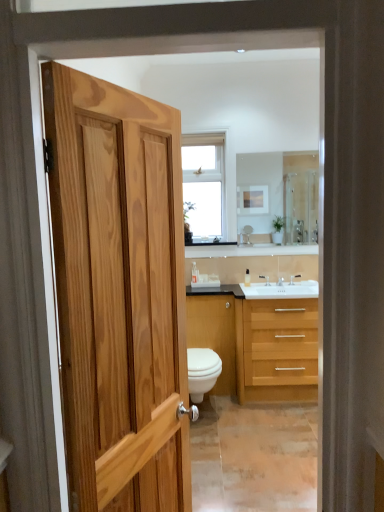
Question: Does satin nickel faucet at center, which appears as the 2th faucet when viewed from the left, have a greater height compared to white glossy toilet at center?

Choices:
 (A) no
 (B) yes

Answer: (A)

Question: From a real-world perspective, is satin nickel faucet at center, which appears as the 2th faucet when viewed from the left, on top of white glossy toilet at center?

Choices:
 (A) yes
 (B) no

Answer: (A)

Question: From the image's perspective, is satin nickel faucet at center, which is counted as the second faucet, starting from the right, beneath white glossy toilet at center?

Choices:
 (A) yes
 (B) no

Answer: (B)

Question: Considering the relative sizes of satin nickel faucet at center, which is counted as the second faucet, starting from the right, and white glossy toilet at center in the image provided, is satin nickel faucet at center, which is counted as the second faucet, starting from the right, wider than white glossy toilet at center?

Choices:
 (A) no
 (B) yes

Answer: (A)

Question: Is satin nickel faucet at center, which is counted as the second faucet, starting from the right, oriented away from white glossy toilet at center?

Choices:
 (A) yes
 (B) no

Answer: (B)

Question: Does satin nickel faucet at center, which is counted as the second faucet, starting from the right, have a larger size compared to white glossy toilet at center?

Choices:
 (A) no
 (B) yes

Answer: (A)

Question: Is translucent plastic bottle at center taller than white glossy cabinet at center?

Choices:
 (A) yes
 (B) no

Answer: (B)

Question: Is translucent plastic bottle at center thinner than white glossy cabinet at center?

Choices:
 (A) no
 (B) yes

Answer: (B)

Question: Is translucent plastic bottle at center far from white glossy cabinet at center?

Choices:
 (A) no
 (B) yes

Answer: (A)

Question: Is white glossy cabinet at center at the back of translucent plastic bottle at center?

Choices:
 (A) yes
 (B) no

Answer: (B)

Question: Is translucent plastic bottle at center completely or partially outside of white glossy cabinet at center?

Choices:
 (A) no
 (B) yes

Answer: (B)

Question: From a real-world perspective, is translucent plastic bottle at center under white glossy cabinet at center?

Choices:
 (A) no
 (B) yes

Answer: (A)

Question: Is clear glass mirror at upper center not close to white glossy toilet at center?

Choices:
 (A) yes
 (B) no

Answer: (A)